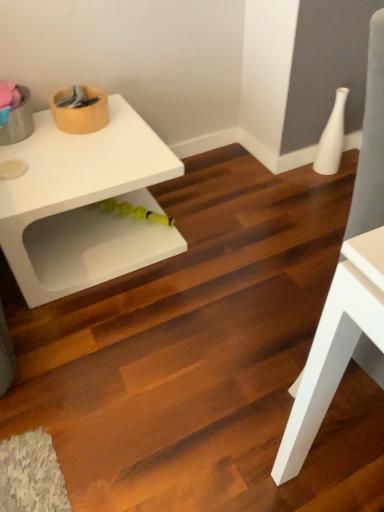
Where is `empty space that is in between white matte table at upper left, the second table when ordered from front to back, and white glossy vase at upper right`? empty space that is in between white matte table at upper left, the second table when ordered from front to back, and white glossy vase at upper right is located at coordinates (232, 196).